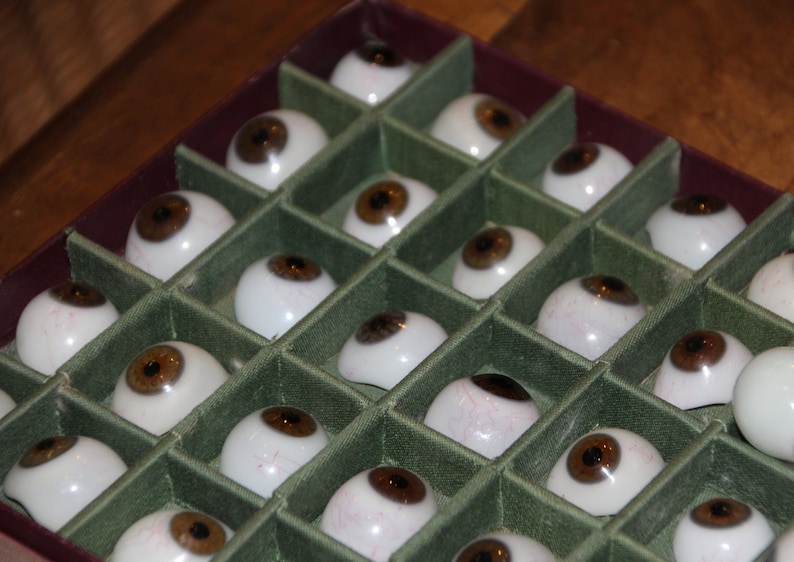
Find the location of a particular element. Image resolution: width=794 pixels, height=562 pixels. hardwood floor top right of box of eyes is located at coordinates (726, 81).